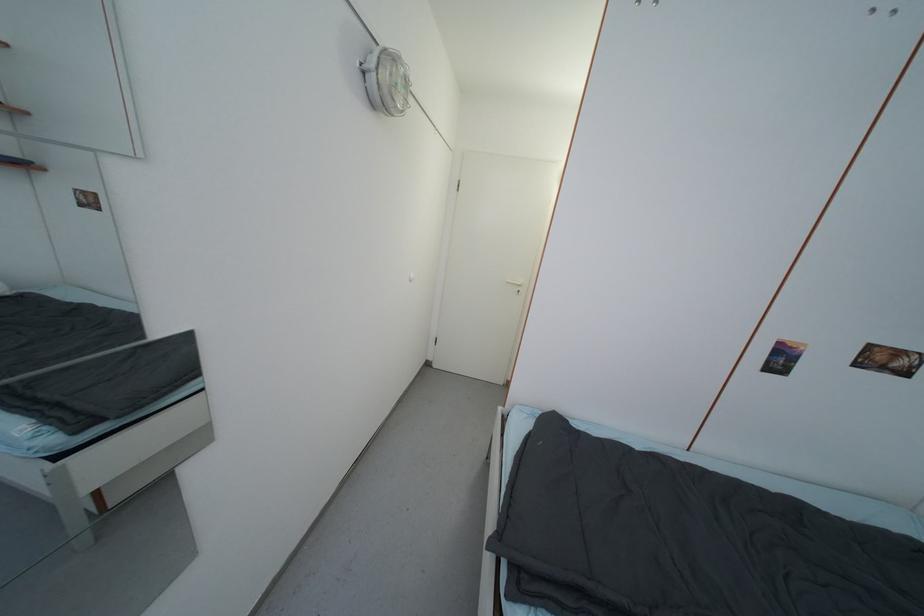
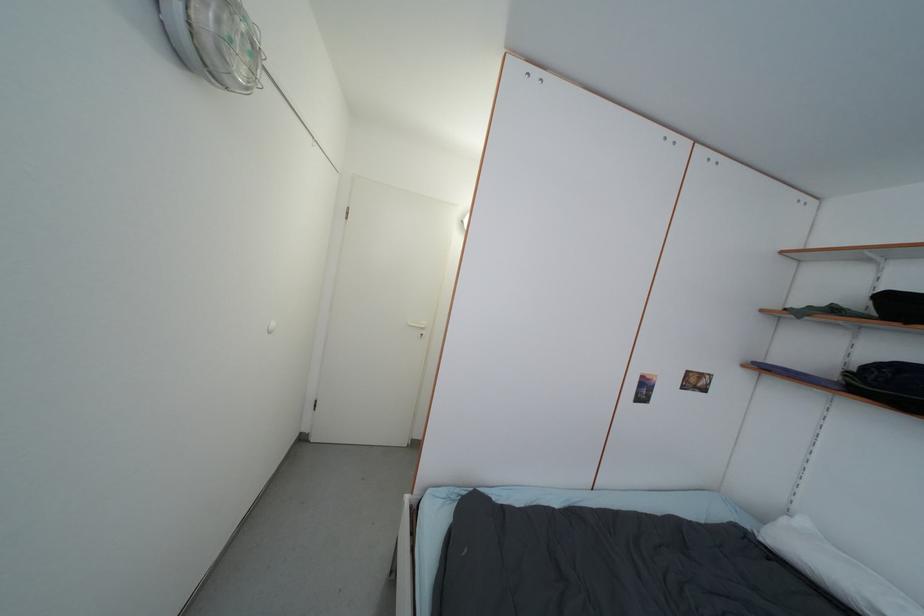
Where in the second image is the point corresponding to the point at 523,288 from the first image?

(427, 331)